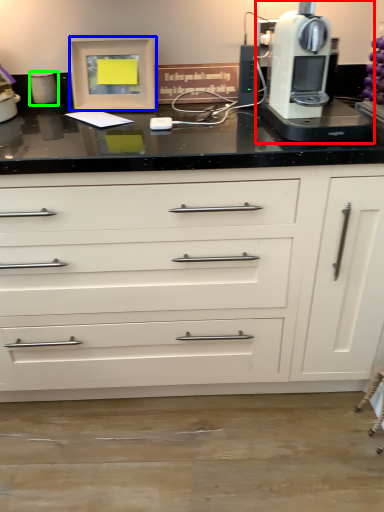
Question: Which is farther away from home appliance (highlighted by a red box)? picture frame (highlighted by a blue box) or kitchen appliance (highlighted by a green box)?

Choices:
 (A) picture frame
 (B) kitchen appliance

Answer: (B)